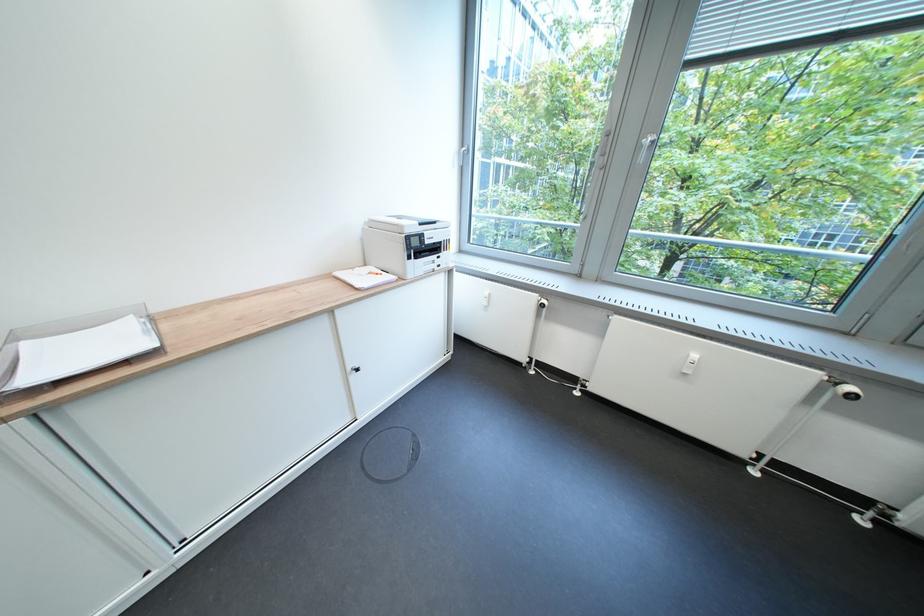
At what (x,y) coordinates should I click in order to perform the action: click on radiator valve knob. Please return your answer as a coordinate pair (x, y). This screenshot has height=616, width=924. Looking at the image, I should click on (542, 302).